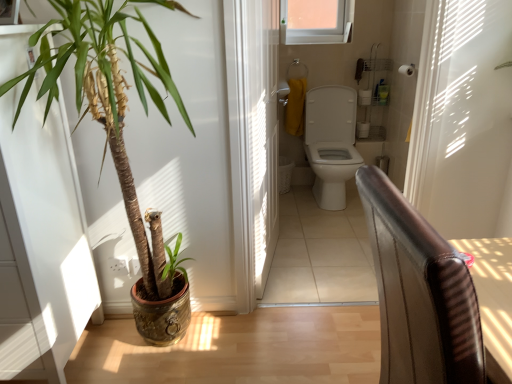
Find the location of a particular element. This screenshot has width=512, height=384. free area below green leafy plant at left (from a real-world perspective) is located at coordinates (141, 352).